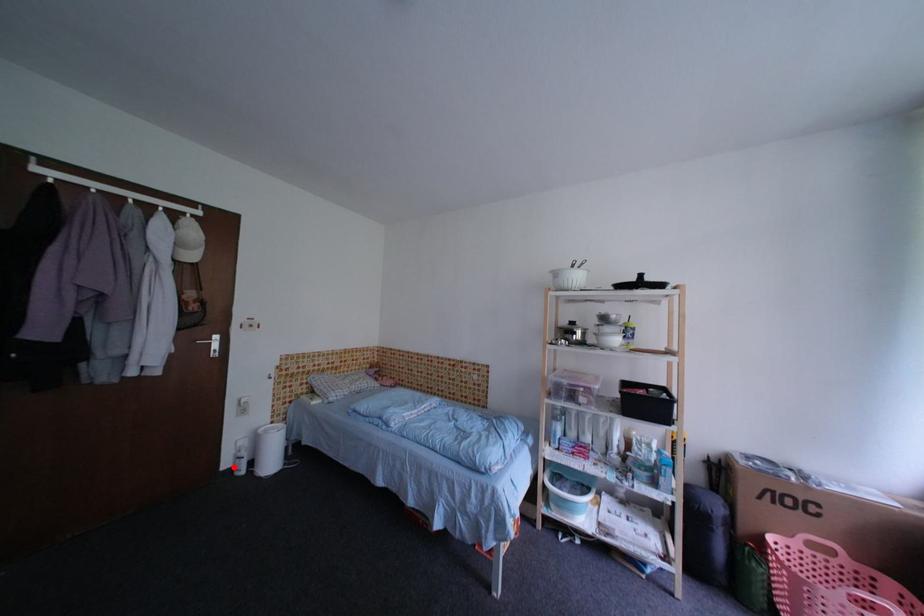
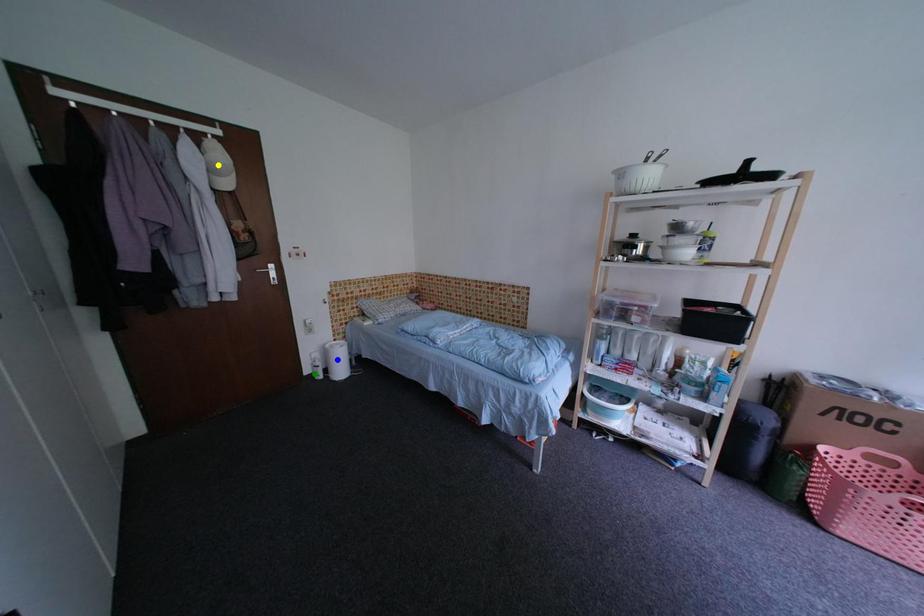
Question: I am providing you with two images of the same scene from different viewpoints. A red point is marked on the first image. You are given multiple points on the second image. Which mark in image 2 goes with the point in image 1?

Choices:
 (A) blue point
 (B) yellow point
 (C) green point

Answer: (C)